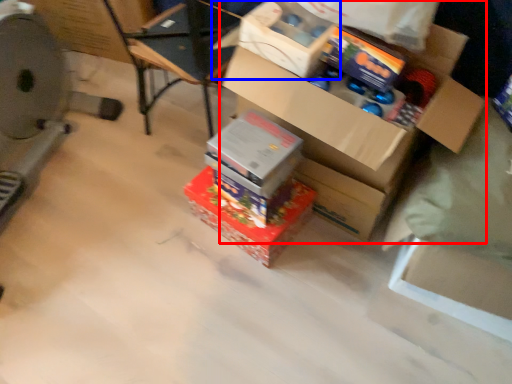
Question: Which point is further to the camera, box (highlighted by a red box) or storage box (highlighted by a blue box)?

Choices:
 (A) box
 (B) storage box

Answer: (B)